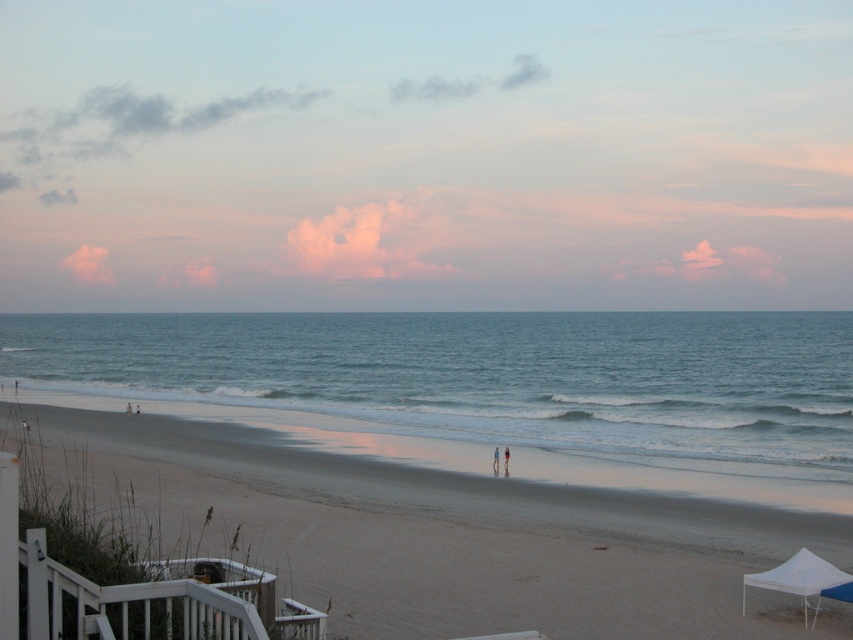
Question: Based on their relative distances, which object is farther from the white wooden railing at lower left?

Choices:
 (A) blue water at center
 (B) white fabric tent at lower right

Answer: (A)

Question: Considering the relative positions of white wooden railing at lower left and white fabric tent at lower right in the image provided, where is white wooden railing at lower left located with respect to white fabric tent at lower right?

Choices:
 (A) below
 (B) above

Answer: (B)

Question: Can you confirm if blue water at center is positioned to the right of white fabric tent at lower right?

Choices:
 (A) yes
 (B) no

Answer: (A)

Question: Is white wooden railing at lower left to the right of white fabric tent at lower right from the viewer's perspective?

Choices:
 (A) yes
 (B) no

Answer: (B)

Question: Which point is closer to the camera taking this photo?

Choices:
 (A) (741, 508)
 (B) (811, 371)
 (C) (19, 602)

Answer: (C)

Question: Which object is closer to the camera taking this photo?

Choices:
 (A) white fabric tent at lower right
 (B) blue water at center
 (C) sandy beach at lower center
 (D) white wooden railing at lower left

Answer: (D)